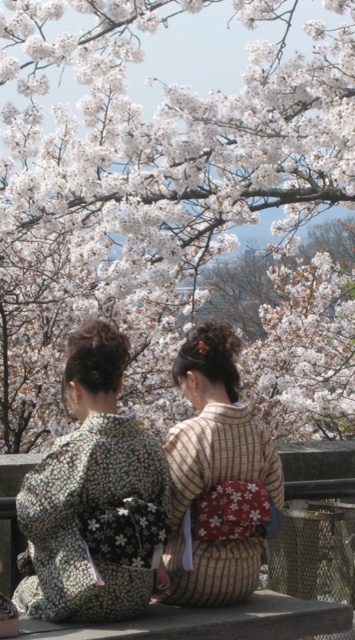
Is white blossoms at center above floral-patterned kimono at center?

Correct, white blossoms at center is located above floral-patterned kimono at center.

Does white blossoms at center have a lesser width compared to floral-patterned kimono at center?

Incorrect, white blossoms at center's width is not less than floral-patterned kimono at center's.

Is point (292, 186) more distant than point (51, 504)?

Yes, it is.

Where is `white blossoms at center`? white blossoms at center is located at coordinates (150, 180).

In the scene shown: Is white blossoms at center positioned before floral kimono at center?

No, it is not.

Locate an element on the screen. This screenshot has width=355, height=640. white blossoms at center is located at coordinates (150, 180).

Image resolution: width=355 pixels, height=640 pixels. I want to click on white blossoms at center, so click(150, 180).

Find the location of a particular element. This screenshot has height=640, width=355. floral kimono at center is located at coordinates (149, 490).